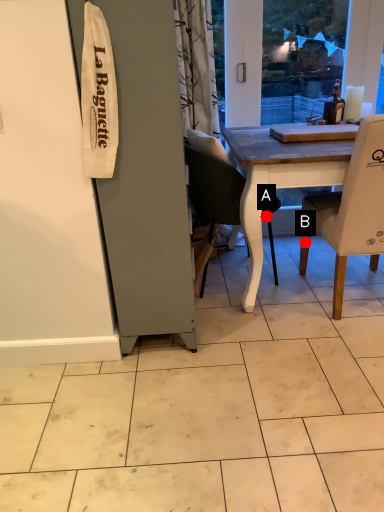
Question: Two points are circled on the image, labeled by A and B beside each circle. Which point is closer to the camera taking this photo?

Choices:
 (A) A is closer
 (B) B is closer

Answer: (A)